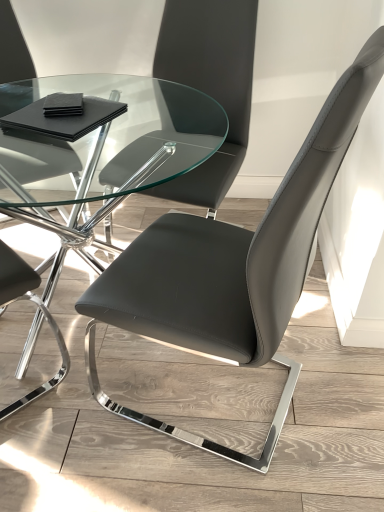
Question: Is matte black chair at center, placed as the 2th chair when sorted from top to bottom, a part of matte black chair at center, acting as the 2th chair starting from the bottom?

Choices:
 (A) no
 (B) yes

Answer: (A)

Question: Are matte black chair at center, the first chair positioned from the top, and matte black chair at center, placed as the 2th chair when sorted from top to bottom, located far from each other?

Choices:
 (A) no
 (B) yes

Answer: (A)

Question: Considering the relative sizes of matte black chair at center, the first chair positioned from the top, and matte black chair at center, which is counted as the first chair, starting from the bottom, in the image provided, is matte black chair at center, the first chair positioned from the top, taller than matte black chair at center, which is counted as the first chair, starting from the bottom,?

Choices:
 (A) no
 (B) yes

Answer: (A)

Question: Is the surface of matte black chair at center, the first chair positioned from the top, in direct contact with matte black chair at center, placed as the 2th chair when sorted from top to bottom?

Choices:
 (A) yes
 (B) no

Answer: (B)

Question: Can you confirm if matte black chair at center, the first chair positioned from the top, is positioned to the left of matte black chair at center, placed as the 2th chair when sorted from top to bottom?

Choices:
 (A) yes
 (B) no

Answer: (A)

Question: Is point (155, 112) closer or farther from the camera than point (208, 32)?

Choices:
 (A) farther
 (B) closer

Answer: (A)

Question: From the image's perspective, is transparent glass table at center positioned above or below matte black chair at center, the first chair positioned from the top?

Choices:
 (A) above
 (B) below

Answer: (B)

Question: Would you say transparent glass table at center is inside or outside matte black chair at center, acting as the 2th chair starting from the bottom?

Choices:
 (A) outside
 (B) inside

Answer: (A)

Question: Considering the relative positions of transparent glass table at center and matte black chair at center, acting as the 2th chair starting from the bottom, in the image provided, is transparent glass table at center to the left or to the right of matte black chair at center, acting as the 2th chair starting from the bottom,?

Choices:
 (A) right
 (B) left

Answer: (B)

Question: In terms of width, does matte black chair at center, which is counted as the first chair, starting from the bottom, look wider or thinner when compared to transparent glass table at center?

Choices:
 (A) thin
 (B) wide

Answer: (A)

Question: Would you say matte black chair at center, placed as the 2th chair when sorted from top to bottom, is to the left or to the right of transparent glass table at center in the picture?

Choices:
 (A) left
 (B) right

Answer: (B)

Question: From the image's perspective, is matte black chair at center, which is counted as the first chair, starting from the bottom, located above or below transparent glass table at center?

Choices:
 (A) below
 (B) above

Answer: (A)

Question: Is matte black chair at center, placed as the 2th chair when sorted from top to bottom, in front of or behind transparent glass table at center in the image?

Choices:
 (A) front
 (B) behind

Answer: (A)

Question: From a real-world perspective, relative to matte black chair at center, which is counted as the first chair, starting from the bottom, is matte black chair at center, acting as the 2th chair starting from the bottom, vertically above or below?

Choices:
 (A) below
 (B) above

Answer: (B)

Question: From their relative heights in the image, would you say matte black chair at center, acting as the 2th chair starting from the bottom, is taller or shorter than matte black chair at center, placed as the 2th chair when sorted from top to bottom?

Choices:
 (A) tall
 (B) short

Answer: (B)